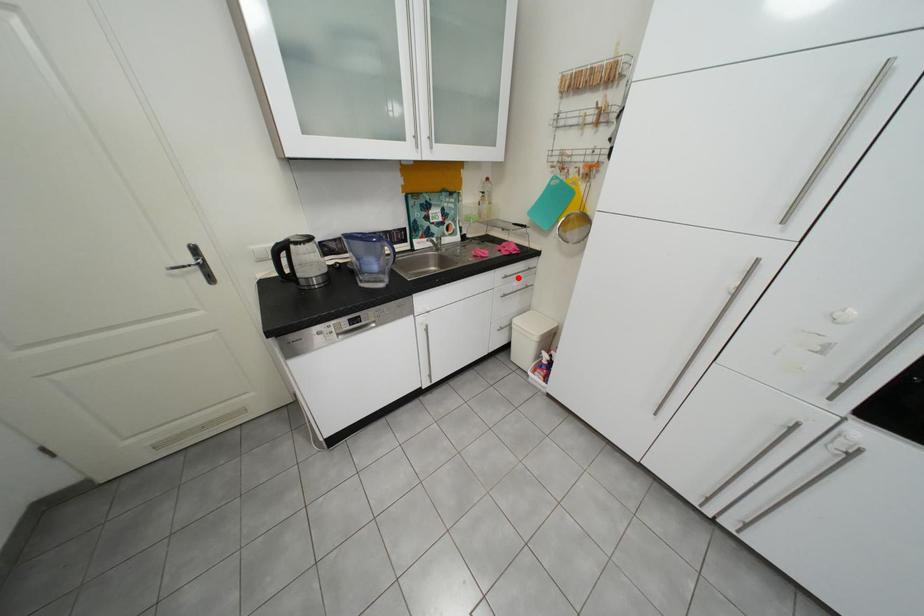
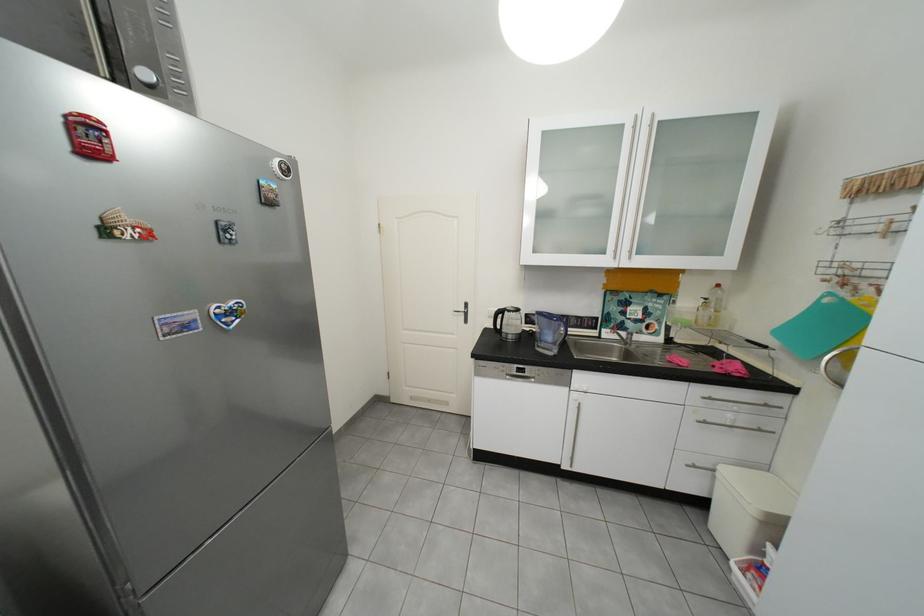
Where in the second image is the point corresponding to the highlighted location from the first image?

(723, 400)